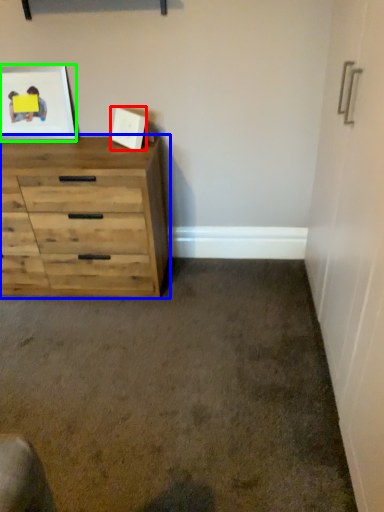
Question: Which object is positioned farthest from picture frame (highlighted by a red box)? Select from chest of drawers (highlighted by a blue box) and picture frame (highlighted by a green box).

Choices:
 (A) chest of drawers
 (B) picture frame

Answer: (A)